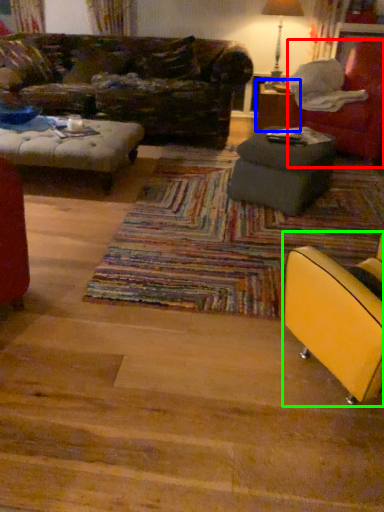
Question: Which object is the farthest from chair (highlighted by a red box)? Choose among these: table (highlighted by a blue box) or chair (highlighted by a green box).

Choices:
 (A) table
 (B) chair

Answer: (B)